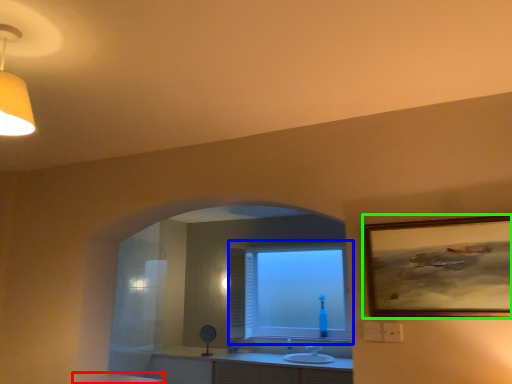
Question: Based on their relative distances, which object is nearer to counter top (highlighted by a red box)? Choose from window (highlighted by a blue box) and picture frame (highlighted by a green box).

Choices:
 (A) window
 (B) picture frame

Answer: (A)